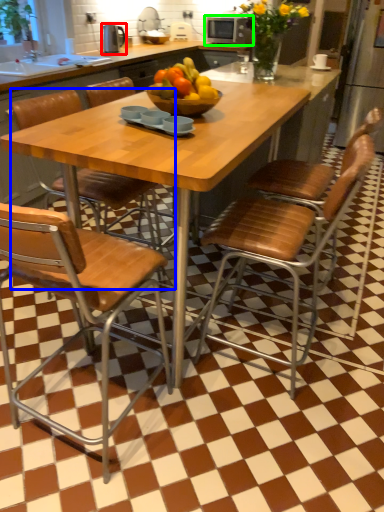
Question: Which object is positioned farthest from appliance (highlighted by a red box)? Select from chair (highlighted by a blue box) and appliance (highlighted by a green box).

Choices:
 (A) chair
 (B) appliance

Answer: (A)